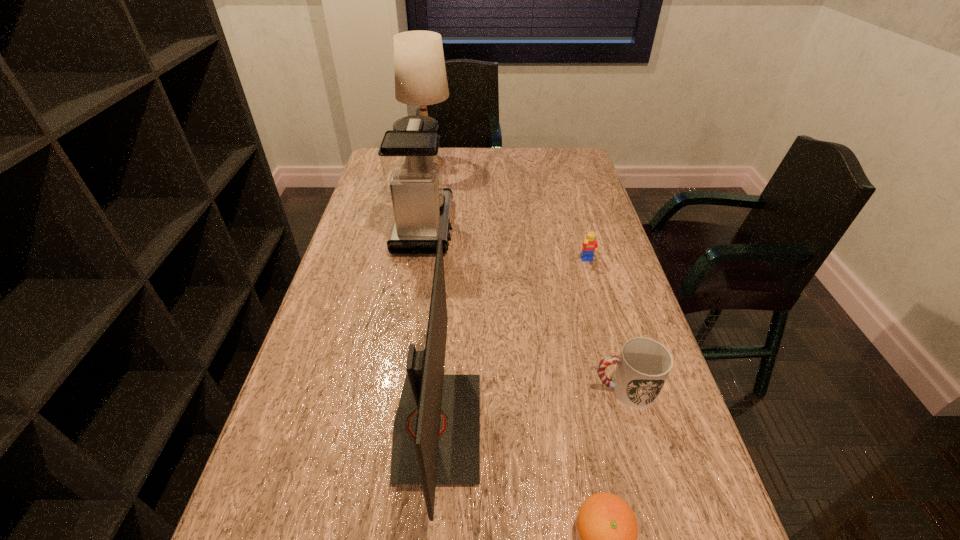
This screenshot has width=960, height=540. I want to click on free region located 0.230m on the face of the Lego, so click(607, 327).

This screenshot has height=540, width=960. What are the coordinates of `object situated at the far edge` in the screenshot? It's located at (420, 75).

Find the location of a particular element. The width and height of the screenshot is (960, 540). lamp situated at the left edge is located at coordinates (420, 75).

Locate an element on the screen. coffee maker present at the left edge is located at coordinates (409, 155).

At what (x,y) coordinates should I click in order to perform the action: click on cup situated at the right edge. Please return your answer as a coordinate pair (x, y). Looking at the image, I should click on (643, 366).

This screenshot has height=540, width=960. In order to click on Lego that is at the right edge in this screenshot , I will do `click(589, 246)`.

I want to click on object located at the far left corner, so click(420, 75).

Where is `free region at the far edge`? This screenshot has height=540, width=960. free region at the far edge is located at coordinates (498, 155).

At what (x,y) coordinates should I click in order to perform the action: click on vacant space at the left edge of the desktop. Please return your answer as a coordinate pair (x, y). Looking at the image, I should click on (354, 363).

Identify the location of free space at the right edge of the desktop. (655, 464).